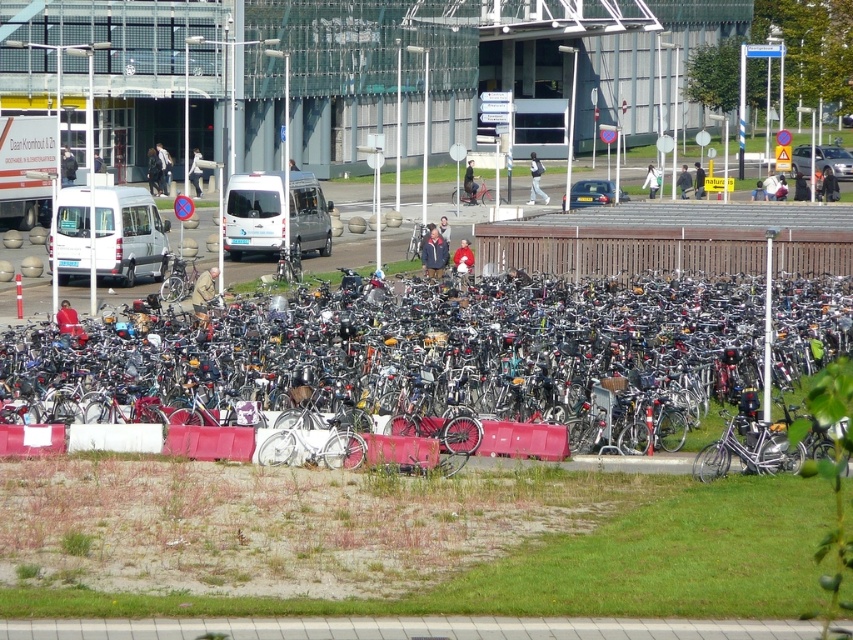
Question: Which point is farther to the camera?

Choices:
 (A) (575, 438)
 (B) (509, 266)

Answer: (B)

Question: Is silver metallic bicycle at center bigger than brown wooden fence at center?

Choices:
 (A) no
 (B) yes

Answer: (B)

Question: Which point is farther from the camera taking this photo?

Choices:
 (A) (837, 284)
 (B) (492, 253)

Answer: (B)

Question: Among these objects, which one is nearest to the camera?

Choices:
 (A) brown wooden fence at center
 (B) silver metallic bicycle at center

Answer: (B)

Question: Can you confirm if silver metallic bicycle at center is smaller than brown wooden fence at center?

Choices:
 (A) no
 (B) yes

Answer: (A)

Question: Is silver metallic bicycle at center smaller than brown wooden fence at center?

Choices:
 (A) yes
 (B) no

Answer: (B)